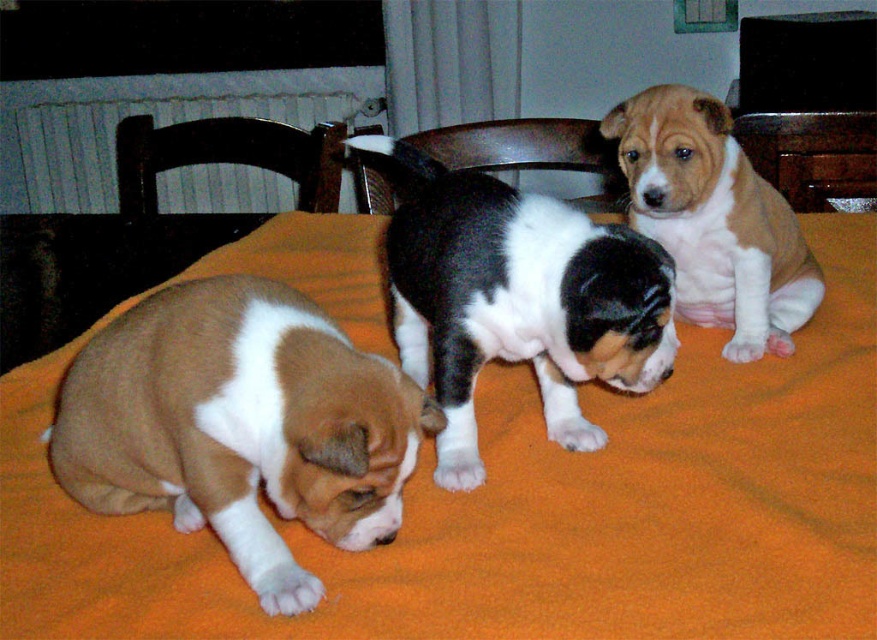
Question: Which object is closer to the camera taking this photo?

Choices:
 (A) wooden chair at center
 (B) black and white fur at center
 (C) dark wood chair at upper left

Answer: (B)

Question: Based on their relative distances, which object is farther from the brown and white fur puppy at upper right?

Choices:
 (A) orange fleece blanket at center
 (B) dark wood chair at upper left
 (C) black and white fur at center
 (D) brown and white fur at lower left

Answer: (B)

Question: Among these objects, which one is farthest from the camera?

Choices:
 (A) black and white fur at center
 (B) wooden chair at center
 (C) orange fleece blanket at center
 (D) brown and white fur at lower left

Answer: (B)

Question: Does brown and white fur puppy at upper right appear under wooden chair at center?

Choices:
 (A) yes
 (B) no

Answer: (A)

Question: Is dark wood chair at upper left closer to camera compared to wooden chair at center?

Choices:
 (A) yes
 (B) no

Answer: (A)

Question: Can you confirm if orange fleece blanket at center is bigger than dark wood chair at upper left?

Choices:
 (A) yes
 (B) no

Answer: (A)